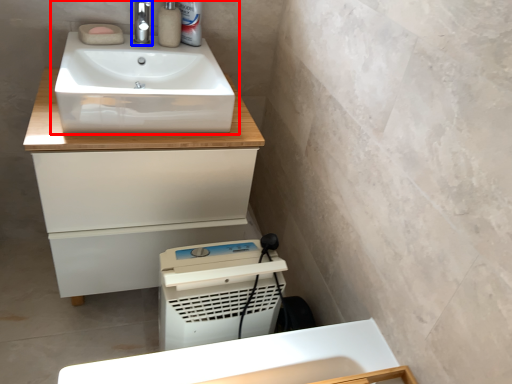
Question: Which object is closer to the camera taking this photo, sink (highlighted by a red box) or tap (highlighted by a blue box)?

Choices:
 (A) sink
 (B) tap

Answer: (A)